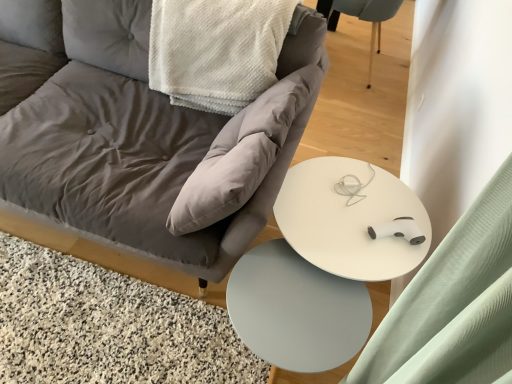
Image resolution: width=512 pixels, height=384 pixels. What are the coordinates of `free space above white glossy round table at center (from a real-world perspective)` in the screenshot? It's located at pos(372,216).